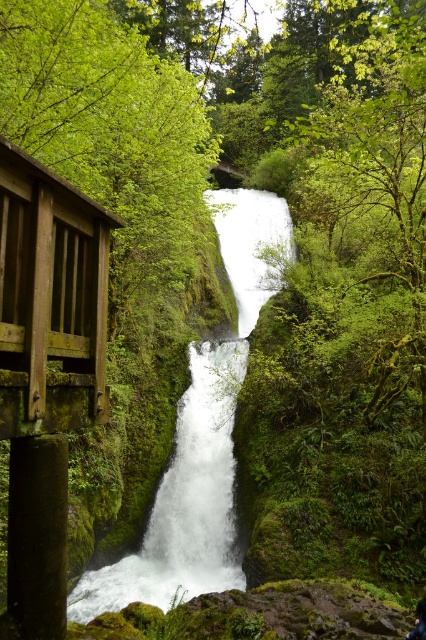
Who is taller, white smooth waterfall at center or white frothy water at center?

white smooth waterfall at center is taller.

Is point (247, 208) more distant than point (232, 353)?

Yes, point (247, 208) is farther from viewer.

Image resolution: width=426 pixels, height=640 pixels. Describe the element at coordinates (199, 436) in the screenshot. I see `white smooth waterfall at center` at that location.

The width and height of the screenshot is (426, 640). Find the location of `white smooth waterfall at center`. white smooth waterfall at center is located at coordinates (199, 436).

Is white smooth waterfall at center smaller than dark blue fabric at lower right?

No.

Between white smooth waterfall at center and dark blue fabric at lower right, which one has more height?

With more height is white smooth waterfall at center.

What are the coordinates of `white smooth waterfall at center` in the screenshot? It's located at (199, 436).

Is point (222, 352) closer to viewer compared to point (414, 624)?

No.

Who is higher up, white frothy water at center or dark blue fabric at lower right?

white frothy water at center is above.

Between point (181, 547) and point (425, 616), which one is positioned in front?

Positioned in front is point (425, 616).

Find the location of a particular element. white frothy water at center is located at coordinates 198,481.